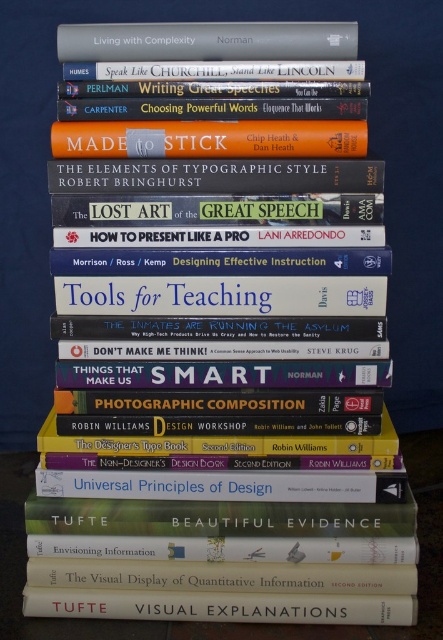
Question: Which point appears farthest from the camera in this image?

Choices:
 (A) (257, 51)
 (B) (268, 612)

Answer: (B)

Question: Is matte white book at center in front of hardcover book at upper center?

Choices:
 (A) yes
 (B) no

Answer: (B)

Question: Can you confirm if matte white book at center is wider than hardcover book at upper center?

Choices:
 (A) no
 (B) yes

Answer: (B)

Question: Which object appears farthest from the camera in this image?

Choices:
 (A) hardcover book at upper center
 (B) matte white book at center

Answer: (B)

Question: Which point is farther from the camera taking this photo?

Choices:
 (A) (229, 49)
 (B) (354, 616)

Answer: (B)

Question: Is the position of matte white book at center more distant than that of hardcover book at upper center?

Choices:
 (A) yes
 (B) no

Answer: (A)